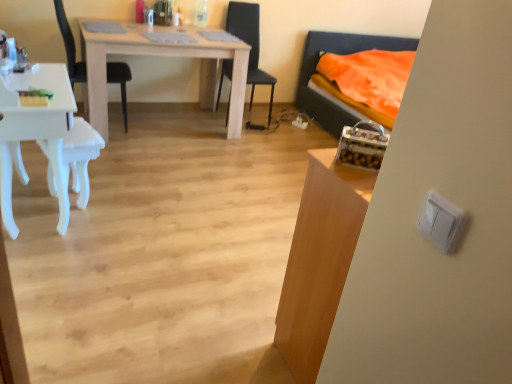
The image size is (512, 384). What do you see at coordinates (34, 133) in the screenshot?
I see `white glossy desk at left` at bounding box center [34, 133].

Where is `white glossy desk at left`? The width and height of the screenshot is (512, 384). white glossy desk at left is located at coordinates (34, 133).

The width and height of the screenshot is (512, 384). Find the location of `white glossy armchair at lower left`. white glossy armchair at lower left is located at coordinates (80, 156).

You are a GUI agent. You are given a task and a screenshot of the screen. Output one action in this format:
    pyautogui.click(x=<x>, y=<y>)
    Task: Click on the white glossy switch at right, the first table viewed from the front
    This screenshot has width=512, height=384.
    Given the screenshot: What is the action you would take?
    pyautogui.click(x=319, y=260)

Describe the element at coordinates (251, 48) in the screenshot. I see `black leather chair at center, positioned as the second chair in left-to-right order` at that location.

Where is `white glossy desk at left`? The height and width of the screenshot is (384, 512). white glossy desk at left is located at coordinates (34, 133).

Who is taller, white plastic light switch at right or white glossy desk at left?

Standing taller between the two is white glossy desk at left.

How different are the orientations of white plastic light switch at right and white glossy desk at left in degrees?

white plastic light switch at right and white glossy desk at left are facing 180 degrees away from each other.

Is white plastic light switch at right looking in the opposite direction of white glossy desk at left?

white plastic light switch at right does not have its back to white glossy desk at left.

Considering the relative sizes of white glossy armchair at lower left and white glossy desk at left in the image provided, is white glossy armchair at lower left wider than white glossy desk at left?

No, white glossy armchair at lower left is not wider than white glossy desk at left.

Which is behind, white glossy armchair at lower left or white glossy desk at left?

white glossy armchair at lower left is more distant.

Does white glossy armchair at lower left appear on the left side of white glossy desk at left?

No.

Starting from the light wood table at center, which ranks as the 1th table in top-to-bottom order, which chair is the 2nd one behind? Please provide its 2D coordinates.

[(251, 48)]

From the image's perspective, is light wood table at center, the second table in the bottom-to-top sequence, below black leather chair at center, positioned as the second chair in left-to-right order?

Correct, light wood table at center, the second table in the bottom-to-top sequence, appears lower than black leather chair at center, positioned as the second chair in left-to-right order, in the image.

Considering the positions of point (125, 53) and point (253, 41), is point (125, 53) closer or farther from the camera than point (253, 41)?

Point (125, 53) appears to be closer to the viewer than point (253, 41).

From a real-world perspective, which object rests below the other?

light wood table at center, which is the 1th table in back-to-front order, from a real-world perspective.

Which is nearer, (121, 75) or (451, 242)?

The point (451, 242) is more forward.

Is black plastic chair at upper left, the 1th chair in the left-to-right sequence, taller or shorter than white plastic light switch at right?

Clearly, black plastic chair at upper left, the 1th chair in the left-to-right sequence, is taller compared to white plastic light switch at right.

From the image's perspective, is black plastic chair at upper left, the 1th chair in the left-to-right sequence, positioned above or below white plastic light switch at right?

From the image's perspective, black plastic chair at upper left, the 1th chair in the left-to-right sequence, appears above white plastic light switch at right.

Which object is thinner, black plastic chair at upper left, the 1th chair in the left-to-right sequence, or white plastic light switch at right?

white plastic light switch at right is thinner.

Is light wood table at center, which is the 1th table in back-to-front order, a part of black leather chair at center, the first chair positioned from the right?

No, light wood table at center, which is the 1th table in back-to-front order, is not inside black leather chair at center, the first chair positioned from the right.

Considering the positions of objects black leather chair at center, the first chair positioned from the right, and light wood table at center, arranged as the 2th table when viewed from the right, in the image provided, who is more to the left, black leather chair at center, the first chair positioned from the right, or light wood table at center, arranged as the 2th table when viewed from the right,?

light wood table at center, arranged as the 2th table when viewed from the right.

Could you tell me if black leather chair at center, positioned as the second chair in left-to-right order, is facing light wood table at center, arranged as the 2th table when viewed from the right?

No, black leather chair at center, positioned as the second chair in left-to-right order, is not facing towards light wood table at center, arranged as the 2th table when viewed from the right.

From the image's perspective, is black leather chair at center, the first chair positioned from the right, beneath light wood table at center, which is the 2th table in front-to-back order?

No, from the image's perspective, black leather chair at center, the first chair positioned from the right, is not beneath light wood table at center, which is the 2th table in front-to-back order.

Is point (322, 287) closer to camera compared to point (238, 105)?

Yes, it is in front of point (238, 105).

Could you tell me if white glossy switch at right, the second table from the top, is facing light wood table at center, which is the 2th table in front-to-back order?

Yes.

In order to click on table lying on the left of white glossy switch at right, the second table from the top in this screenshot , I will do `click(166, 56)`.

At what (x,y) coordinates should I click in order to perform the action: click on armchair that is under the black plastic chair at upper left, arranged as the second chair when viewed from the right (from a real-world perspective). Please return your answer as a coordinate pair (x, y). This screenshot has width=512, height=384. Looking at the image, I should click on (80, 156).

Is black plastic chair at upper left, arranged as the second chair when viewed from the right, surrounding white glossy armchair at lower left?

Actually, white glossy armchair at lower left is outside black plastic chair at upper left, arranged as the second chair when viewed from the right.

Considering the points (75, 65) and (76, 169), which point is in front, point (75, 65) or point (76, 169)?

Positioned in front is point (76, 169).

Where is `light switch in front of the white glossy desk at left`? Image resolution: width=512 pixels, height=384 pixels. light switch in front of the white glossy desk at left is located at coordinates (441, 222).

In the image, there is a white glossy desk at left. Where is `armchair below it (from the image's perspective)`? Image resolution: width=512 pixels, height=384 pixels. armchair below it (from the image's perspective) is located at coordinates (80, 156).

When comparing their distances from white glossy switch at right, the second table from the top, does black leather chair at center, positioned as the second chair in left-to-right order, or white glossy desk at left seem closer?

The object closer to white glossy switch at right, the second table from the top, is white glossy desk at left.

Considering their positions, is white plastic light switch at right positioned further to light wood table at center, arranged as the 2th table when viewed from the right, than white glossy desk at left?

white plastic light switch at right.

Looking at the image, which one is located closer to white glossy switch at right, which ranks as the second table in left-to-right order, black leather chair at center, the first chair positioned from the right, or white plastic light switch at right?

white plastic light switch at right is positioned closer to the anchor white glossy switch at right, which ranks as the second table in left-to-right order.

When comparing their distances from white glossy desk at left, does white glossy switch at right, the first table viewed from the front, or black plastic chair at upper left, arranged as the second chair when viewed from the right, seem further?

white glossy switch at right, the first table viewed from the front, lies further to white glossy desk at left than the other object.

Estimate the real-world distances between objects in this image. Which object is closer to black leather chair at center, positioned as the second chair in left-to-right order, black plastic chair at upper left, arranged as the second chair when viewed from the right, or light wood table at center, the second table in the bottom-to-top sequence?

The object closer to black leather chair at center, positioned as the second chair in left-to-right order, is light wood table at center, the second table in the bottom-to-top sequence.

Based on their spatial positions, is white glossy desk at left or white glossy armchair at lower left further from white glossy switch at right, the second table from the back?

white glossy desk at left is further to white glossy switch at right, the second table from the back.

When comparing their distances from white plastic light switch at right, does black leather chair at center, positioned as the second chair in left-to-right order, or white glossy desk at left seem closer?

Based on the image, white glossy desk at left appears to be nearer to white plastic light switch at right.

Considering their positions, is light wood table at center, which ranks as the 1th table in top-to-bottom order, positioned further to black leather chair at center, the first chair positioned from the right, than white glossy armchair at lower left?

The object further to black leather chair at center, the first chair positioned from the right, is white glossy armchair at lower left.

The width and height of the screenshot is (512, 384). In order to click on armchair between white glossy desk at left and black plastic chair at upper left, arranged as the second chair when viewed from the right, from front to back in this screenshot , I will do `click(80, 156)`.

At what (x,y) coordinates should I click in order to perform the action: click on desk between black plastic chair at upper left, arranged as the second chair when viewed from the right, and white glossy switch at right, the second table from the back, from left to right. Please return your answer as a coordinate pair (x, y). This screenshot has height=384, width=512. Looking at the image, I should click on (34, 133).

Find the location of a particular element. The width and height of the screenshot is (512, 384). armchair positioned between white glossy switch at right, the first table in the right-to-left sequence, and light wood table at center, which appears as the first table when viewed from the left, from near to far is located at coordinates click(80, 156).

This screenshot has width=512, height=384. What are the coordinates of `armchair situated between black plastic chair at upper left, the 1th chair in the left-to-right sequence, and black leather chair at center, positioned as the second chair in left-to-right order, from left to right` in the screenshot? It's located at (80, 156).